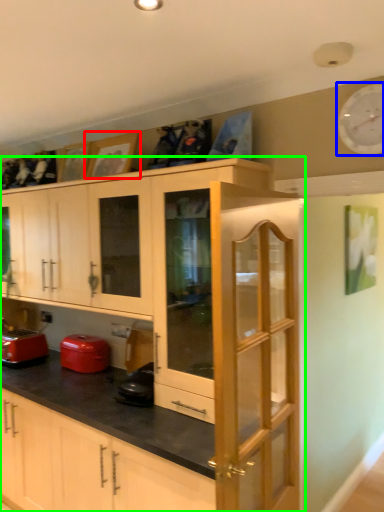
Question: Which object is the closest to the picture frame (highlighted by a red box)? Choose among these: clock (highlighted by a blue box) or cabinetry (highlighted by a green box).

Choices:
 (A) clock
 (B) cabinetry

Answer: (B)